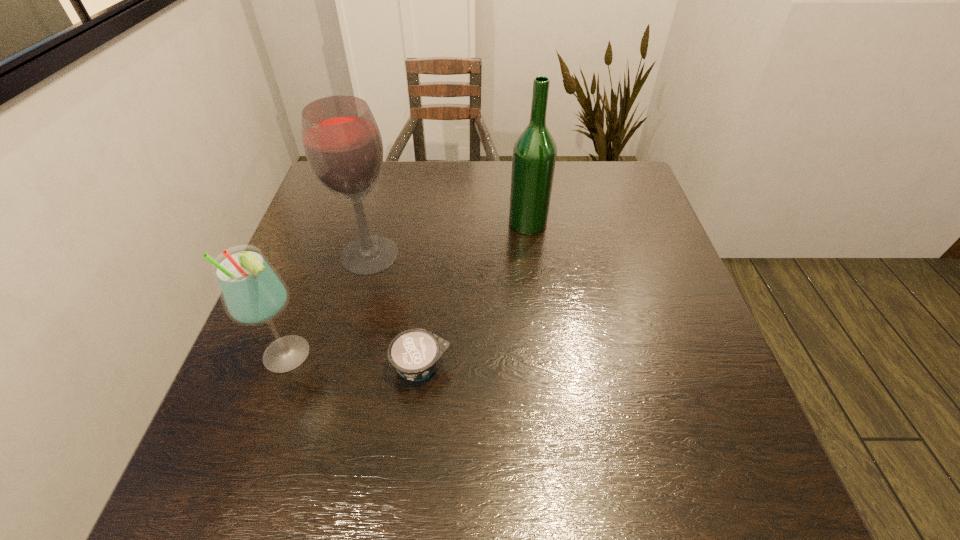
Locate an element on the screen. the rightmost alcohol is located at coordinates (534, 153).

I want to click on the nearest alcohol, so click(x=252, y=292).

This screenshot has height=540, width=960. I want to click on the shortest alcohol, so click(x=252, y=292).

Identify the location of the shortest object. (414, 353).

Locate an element on the screen. yogurt is located at coordinates (414, 353).

The image size is (960, 540). I want to click on free spot located on the right of the rightmost alcohol, so click(x=595, y=223).

The height and width of the screenshot is (540, 960). What are the coordinates of `vacant space located 0.390m on the right of the third tallest object` in the screenshot? It's located at (509, 355).

At what (x,y) coordinates should I click in order to perform the action: click on free point located 0.360m on the back of the shortest object. Please return your answer as a coordinate pair (x, y). Image resolution: width=960 pixels, height=540 pixels. Looking at the image, I should click on (436, 233).

Where is `vacant space at the far edge of the desktop`? The width and height of the screenshot is (960, 540). vacant space at the far edge of the desktop is located at coordinates (442, 170).

Locate an element on the screen. vacant space at the near edge of the desktop is located at coordinates (326, 482).